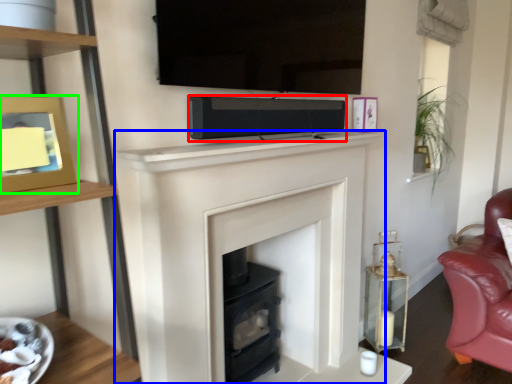
Question: Estimate the real-world distances between objects in this image. Which object is farther from stereo (highlighted by a red box), fireplace (highlighted by a blue box) or picture frame (highlighted by a green box)?

Choices:
 (A) fireplace
 (B) picture frame

Answer: (B)